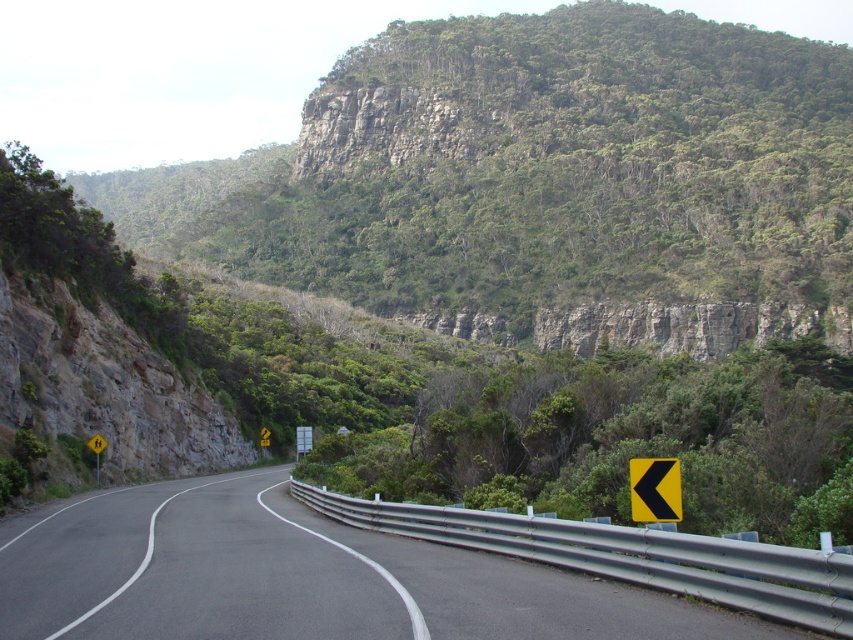
Is black asphalt road at center taller than yellow reflective plastic at right?

Yes.

Is point (268, 586) positioned before point (662, 497)?

No.

Find the location of a particular element. black asphalt road at center is located at coordinates [297, 577].

Does green rocky cliff at upper center appear on the left side of yellow reflective plastic at right?

Correct, you'll find green rocky cliff at upper center to the left of yellow reflective plastic at right.

Can you confirm if green rocky cliff at upper center is taller than yellow reflective plastic at right?

Yes.

Image resolution: width=853 pixels, height=640 pixels. What do you see at coordinates (549, 182) in the screenshot? I see `green rocky cliff at upper center` at bounding box center [549, 182].

Where is `green rocky cliff at upper center`? Image resolution: width=853 pixels, height=640 pixels. green rocky cliff at upper center is located at coordinates (549, 182).

Between point (657, 484) and point (96, 476), which one is positioned behind?

Positioned behind is point (96, 476).

Is yellow reflective plastic at right thinner than yellow reflective plastic at left?

Yes, yellow reflective plastic at right is thinner than yellow reflective plastic at left.

The width and height of the screenshot is (853, 640). Find the location of `yellow reflective plastic at right`. yellow reflective plastic at right is located at coordinates (654, 490).

At what (x,y) coordinates should I click in order to perform the action: click on yellow reflective plastic at right. Please return your answer as a coordinate pair (x, y). The image size is (853, 640). Looking at the image, I should click on (654, 490).